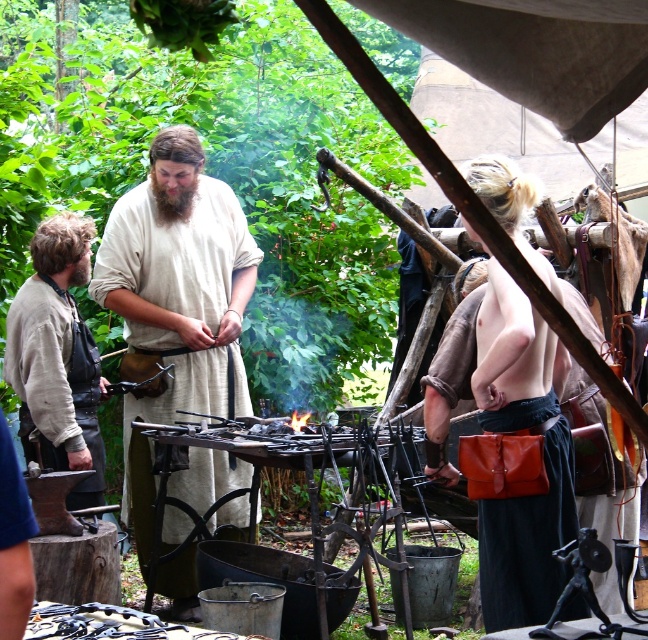
In the scene shown: You are a costume designer analyzing the image for a historical drama. You need to note the exact position of the beige linen tunic at center in the scene. What are its coordinates?

The beige linen tunic at center is located at coordinates (176, 301).

You are standing at the camera position and want to pick up the light beige fabric shirt at left. Is it within a 20 feet distance?

The light beige fabric shirt at left and camera are 21.36 feet apart, so it is beyond the 20 feet distance.